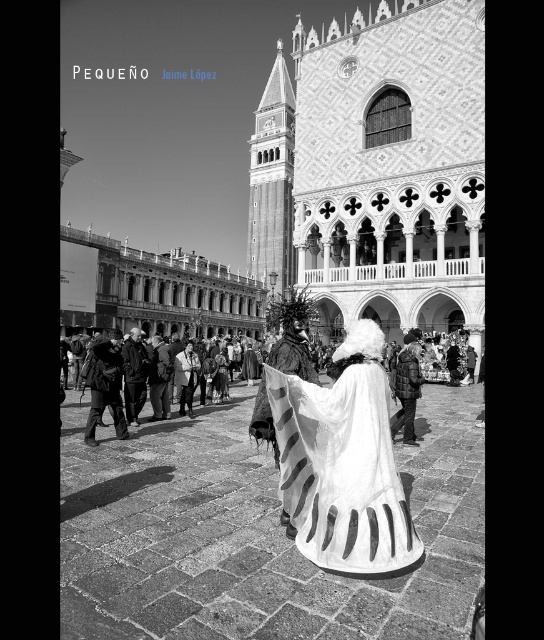
You are a photographer trying to capture a detailed shot of both the white matte dress at center and the dark gray fabric coat at center. Since you want to focus on the textures of both garments, which one should you adjust your camera focus on first to ensure the subject is in sharp focus?

The white matte dress at center is below the dark gray fabric coat at center, so you should focus on the dark gray fabric coat at center first since it is closer to the camera.

You are standing in the public square and want to take a photo of both the bell tower and the person in the white flowing garment with the fluffy hat. To ensure both are in frame, should you position yourself closer to point [390,452] or point [123,355]?

You should position yourself closer to point [123,355] because point [390,452] is in front of point [123,355]. Being closer to the point behind allows both the bell tower and the person to be in the frame without obstruction.

Consider the image. You are standing in the public square and want to take a photo that includes both the bell tower and the person in the white flowing garment with the fluffy hat. Which of the two points, point (132, 349) or point (299, 352), is closer to you and should be prioritized in your composition to ensure the bell tower remains in the background?

Point (132, 349) is closer to you than point (299, 352). Therefore, to prioritize the bell tower in the background, you should focus on point (299, 352) since it is farther away and allows the bell tower to stay in the background.